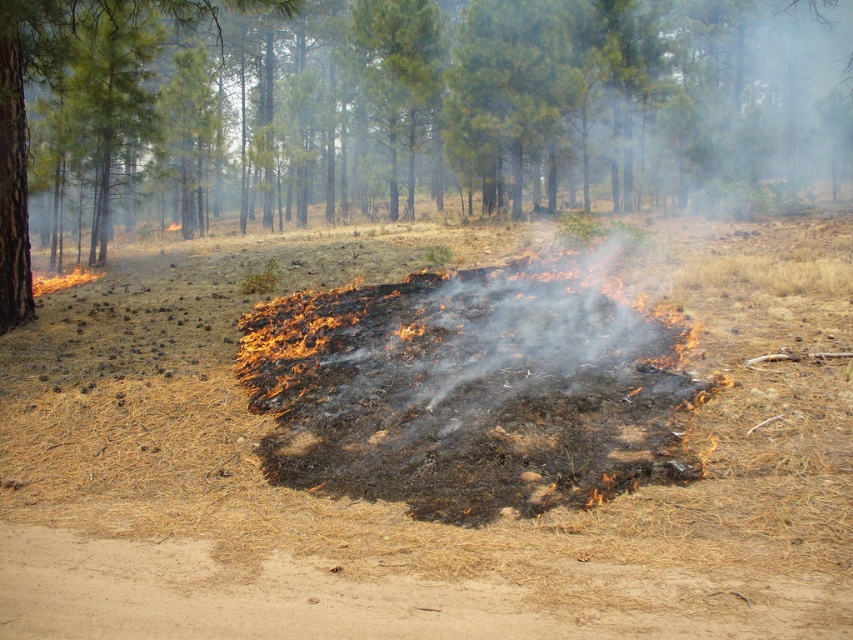
You are a firefighter assessing the burn area. You notice charcoal ash at center and a green leafy tree at center. Which object is closer to the ground?

The charcoal ash at center is shorter than the green leafy tree at center, so the charcoal ash at center is closer to the ground.

You are a firefighter assessing the burn area. You notice a point marked at coordinates (x=399, y=500). What is located at this point?

The charcoal ash at center is located at point (x=399, y=500).

You are a firefighter assessing the burn area. You notice charcoal ash at center and a green leafy tree at center. Which object is positioned to the left?

The charcoal ash at center is to the left of the green leafy tree at center, so the charcoal ash at center is positioned to the left.